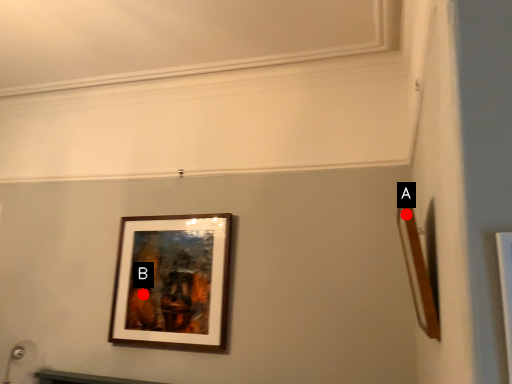
Question: Two points are circled on the image, labeled by A and B beside each circle. Which point is farther to the camera?

Choices:
 (A) A is further
 (B) B is further

Answer: (B)